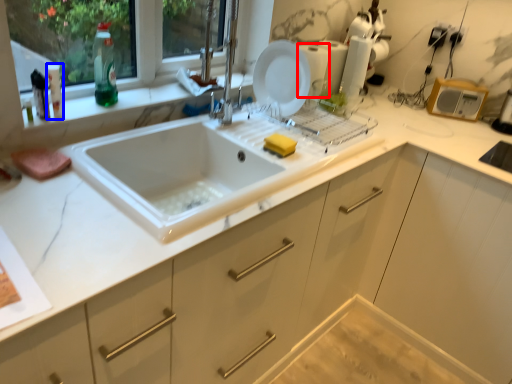
Question: Which object appears closest to the camera in this image, appliance (highlighted by a red box) or bottle (highlighted by a blue box)?

Choices:
 (A) appliance
 (B) bottle

Answer: (B)